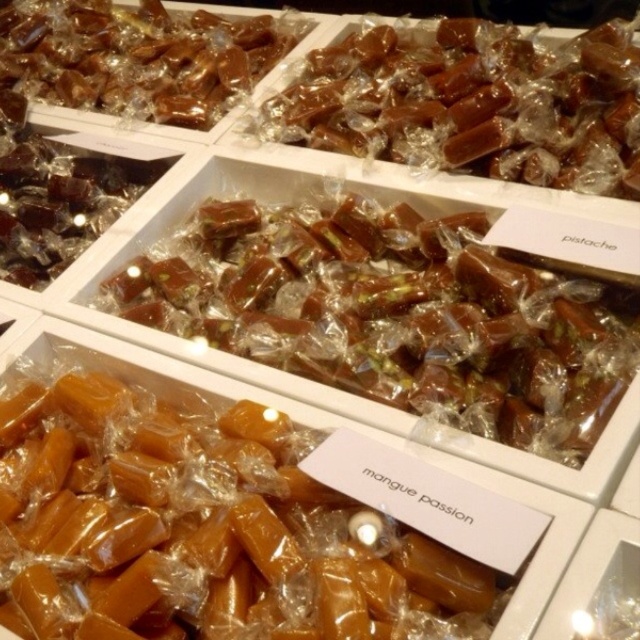
Question: Can you confirm if translucent caramel at center is positioned to the left of matte brown caramel at upper left?

Choices:
 (A) no
 (B) yes

Answer: (A)

Question: Which point appears closest to the camera in this image?

Choices:
 (A) (332, 348)
 (B) (182, 593)

Answer: (B)

Question: Is translucent caramel at center above matte brown caramel at upper left?

Choices:
 (A) yes
 (B) no

Answer: (B)

Question: Does matte caramel candy at lower left appear on the right side of translucent caramel at center?

Choices:
 (A) no
 (B) yes

Answer: (A)

Question: Which point is closer to the camera taking this photo?

Choices:
 (A) (97, 68)
 (B) (568, 97)
 (C) (291, 289)
 (D) (321, 579)

Answer: (D)

Question: Which point is farther from the camera taking this photo?

Choices:
 (A) (180, 481)
 (B) (611, 125)
 (C) (161, 307)

Answer: (B)